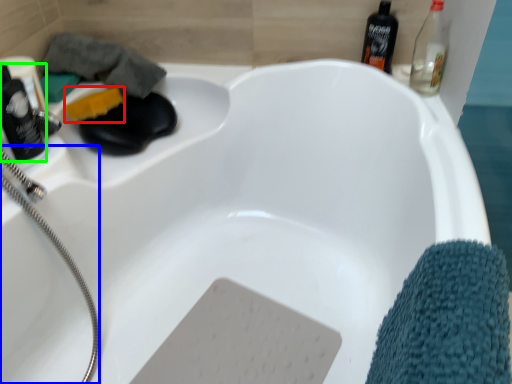
Question: Considering the real-world distances, which object is farthest from soap (highlighted by a red box)? garden hose (highlighted by a blue box) or bottle (highlighted by a green box)?

Choices:
 (A) garden hose
 (B) bottle

Answer: (A)